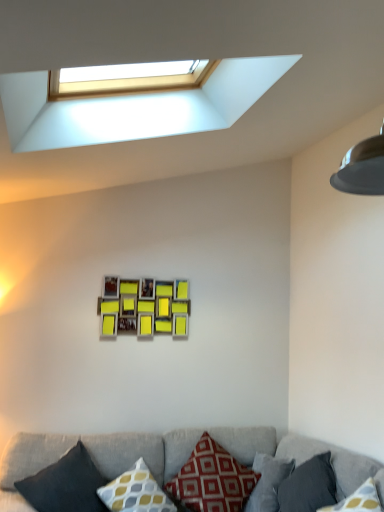
Question: Does textured gray couch at lower center have a lesser width compared to wooden photo frame at center?

Choices:
 (A) no
 (B) yes

Answer: (A)

Question: Considering the relative positions of textured gray couch at lower center and wooden photo frame at center in the image provided, is textured gray couch at lower center to the left of wooden photo frame at center from the viewer's perspective?

Choices:
 (A) no
 (B) yes

Answer: (A)

Question: From a real-world perspective, is textured gray couch at lower center over wooden photo frame at center?

Choices:
 (A) no
 (B) yes

Answer: (A)

Question: Considering the relative positions of textured gray couch at lower center and wooden photo frame at center in the image provided, is textured gray couch at lower center to the right of wooden photo frame at center from the viewer's perspective?

Choices:
 (A) no
 (B) yes

Answer: (B)

Question: Is textured gray couch at lower center looking in the opposite direction of wooden photo frame at center?

Choices:
 (A) yes
 (B) no

Answer: (B)

Question: From the image's perspective, is textured gray couch at lower center below wooden photo frame at center?

Choices:
 (A) yes
 (B) no

Answer: (A)

Question: Considering the relative sizes of white plastic window at upper center and red cotton pillow at center, which is the 3th pillow from right to left, in the image provided, is white plastic window at upper center taller than red cotton pillow at center, which is the 3th pillow from right to left,?

Choices:
 (A) no
 (B) yes

Answer: (B)

Question: Is white plastic window at upper center outside of red cotton pillow at center, which is the 3th pillow from right to left?

Choices:
 (A) yes
 (B) no

Answer: (A)

Question: Is white plastic window at upper center positioned with its back to red cotton pillow at center, which is counted as the third pillow, starting from the left?

Choices:
 (A) no
 (B) yes

Answer: (A)

Question: From the image's perspective, is white plastic window at upper center under red cotton pillow at center, which is the 3th pillow from right to left?

Choices:
 (A) no
 (B) yes

Answer: (A)

Question: Is white plastic window at upper center in contact with red cotton pillow at center, which is counted as the third pillow, starting from the left?

Choices:
 (A) no
 (B) yes

Answer: (A)

Question: From a real-world perspective, is white plastic window at upper center under red cotton pillow at center, which is counted as the third pillow, starting from the left?

Choices:
 (A) no
 (B) yes

Answer: (A)

Question: Is the surface of textured gray couch at lower center in direct contact with dark gray fabric pillow at lower left, which ranks as the 5th pillow in right-to-left order?

Choices:
 (A) yes
 (B) no

Answer: (B)